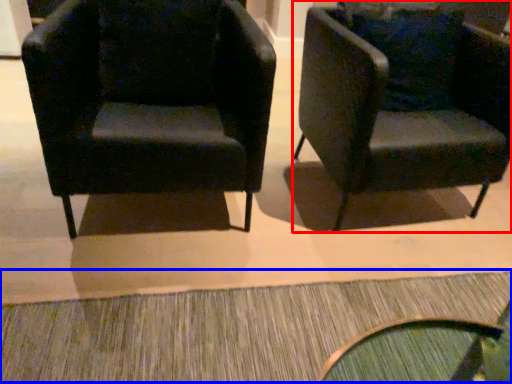
Question: Which of the following is the farthest to the observer, chair (highlighted by a red box) or doormat (highlighted by a blue box)?

Choices:
 (A) chair
 (B) doormat

Answer: (A)